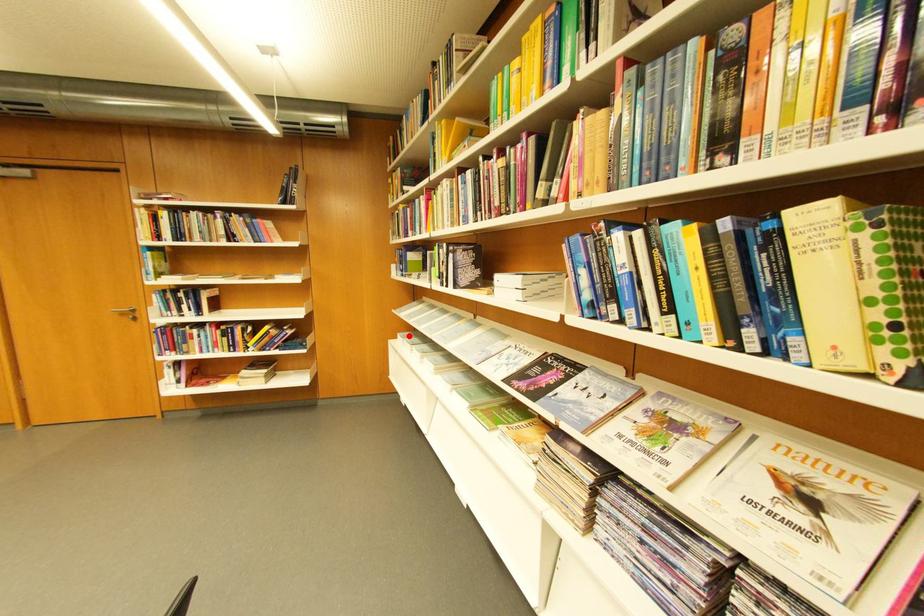
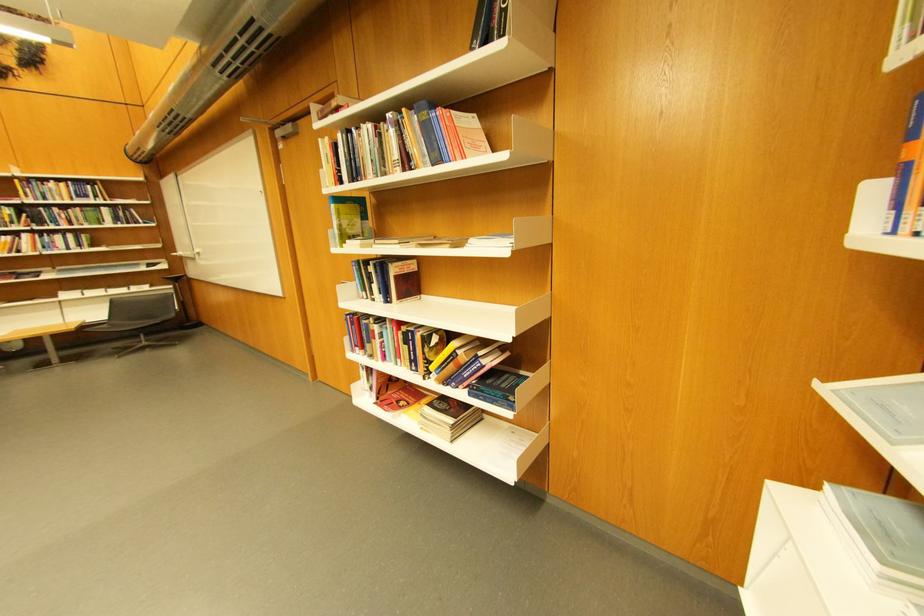
Question: I am providing you with two images of the same scene from different viewpoints. A red point is shown in image1. For the corresponding object point in image2, is it positioned nearer or farther from the camera?

Choices:
 (A) Nearer
 (B) Farther

Answer: (A)